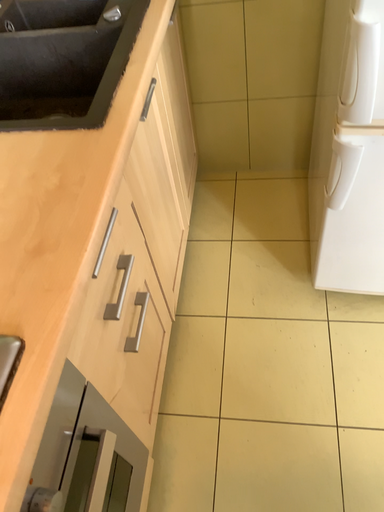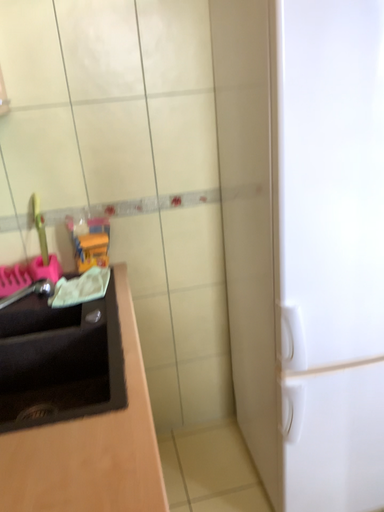
Question: Which way did the camera rotate in the video?

Choices:
 (A) rotated upward
 (B) rotated downward

Answer: (A)